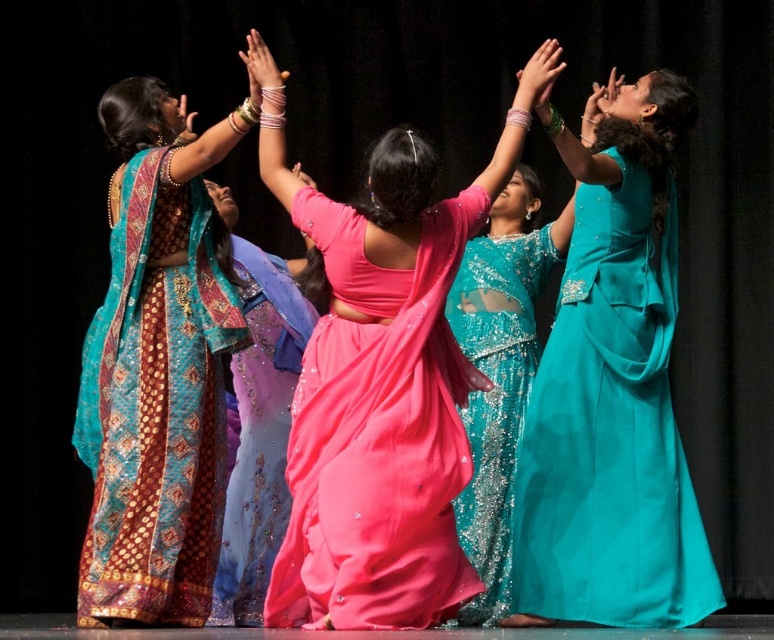
You are a stagehand responsible for placing a 1.5 meter wide decorative archway on stage. The archway must be placed between the pink satin saree at center and the teal silk saree at lower right. Can the archway fit in the space between them?

The distance between the pink satin saree at center and the teal silk saree at lower right is 7.02 meters, so the 1.5 meter wide archway can easily fit in the space between them.

You are a photographer positioned at the front of the stage. You want to capture a closeup shot of the pink satin saree at center. Based on its position, can you estimate whether it will be in the center of your frame?

The pink satin saree at center is located at point (382, 380), which is very close to the center coordinates of the frame. Therefore, it will be positioned near the center of your shot.

You are a photographer at the back of the stage. You want to capture a closeup of the pink satin saree at center and the matte teal saree at left. Which saree should you zoom in on to ensure both are in frame without moving the camera?

The pink satin saree at center is bigger than the matte teal saree at left, so you should zoom in on the pink satin saree at center to ensure both are in frame without moving the camera.